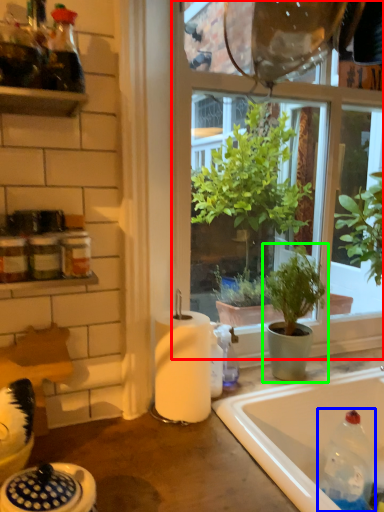
Question: Which object is positioned closest to window (highlighted by a red box)? Select from bottle (highlighted by a blue box) and houseplant (highlighted by a green box).

Choices:
 (A) bottle
 (B) houseplant

Answer: (B)